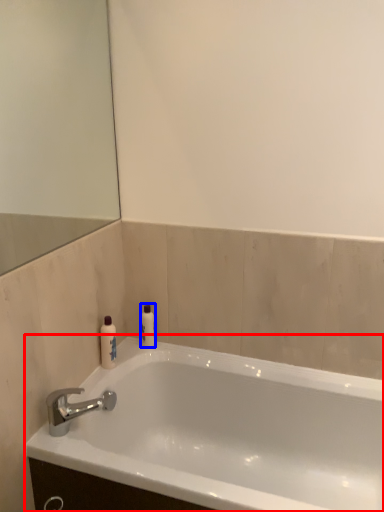
Question: Which of the following is the farthest to the observer, bathtub (highlighted by a red box) or toiletry (highlighted by a blue box)?

Choices:
 (A) bathtub
 (B) toiletry

Answer: (B)